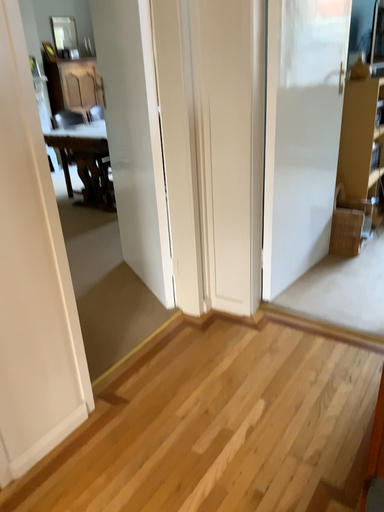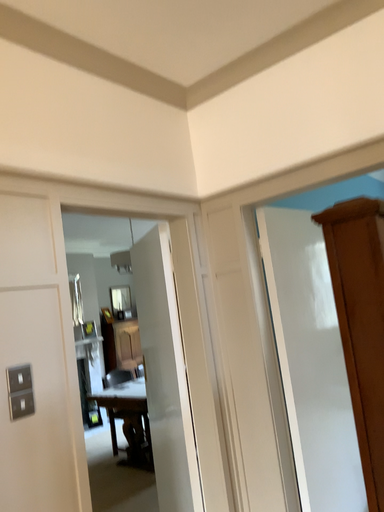
Question: Which way did the camera rotate in the video?

Choices:
 (A) rotated right
 (B) rotated left

Answer: (B)